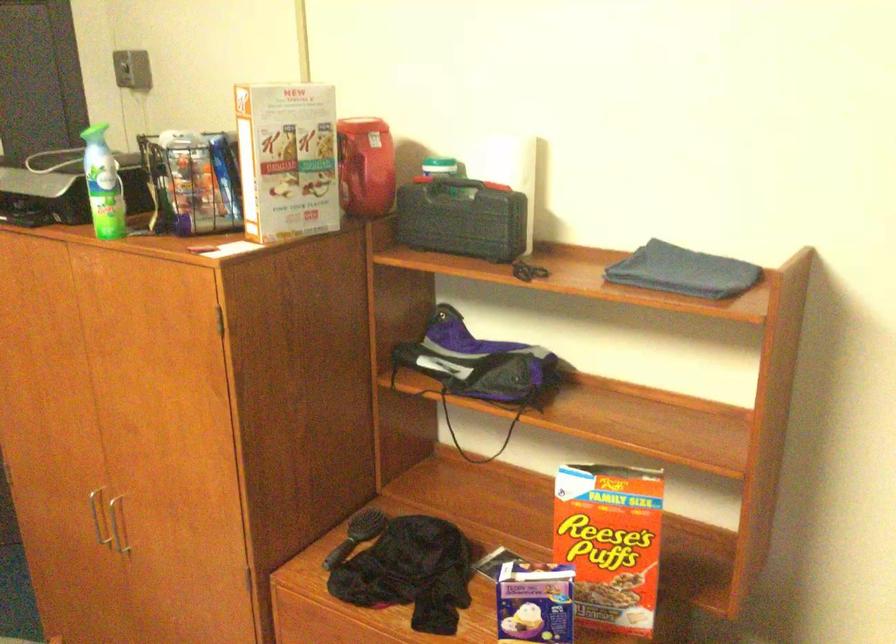
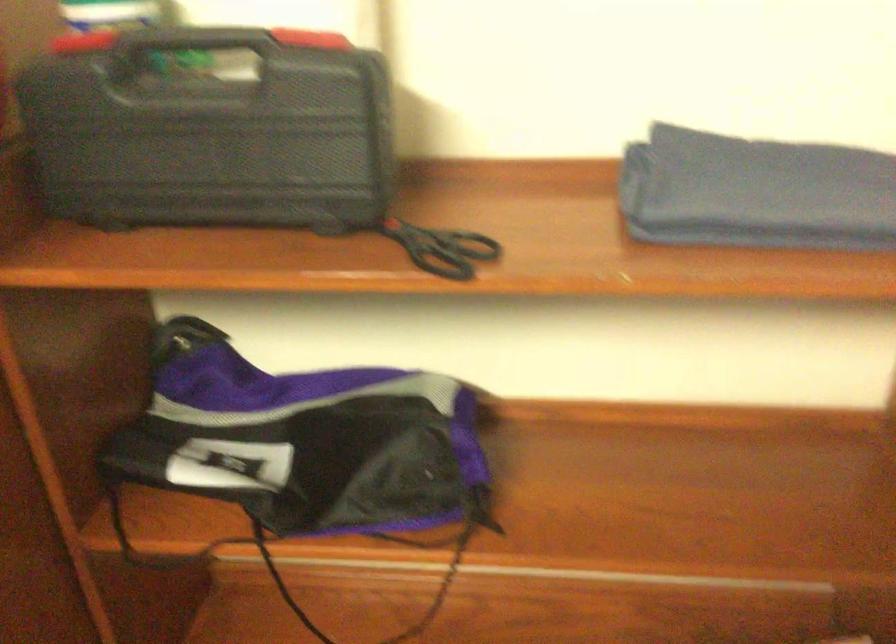
Question: In a continuous first-person perspective shot, in which direction is the camera moving?

Choices:
 (A) Left
 (B) Right
 (C) Forward
 (D) Backward

Answer: (C)